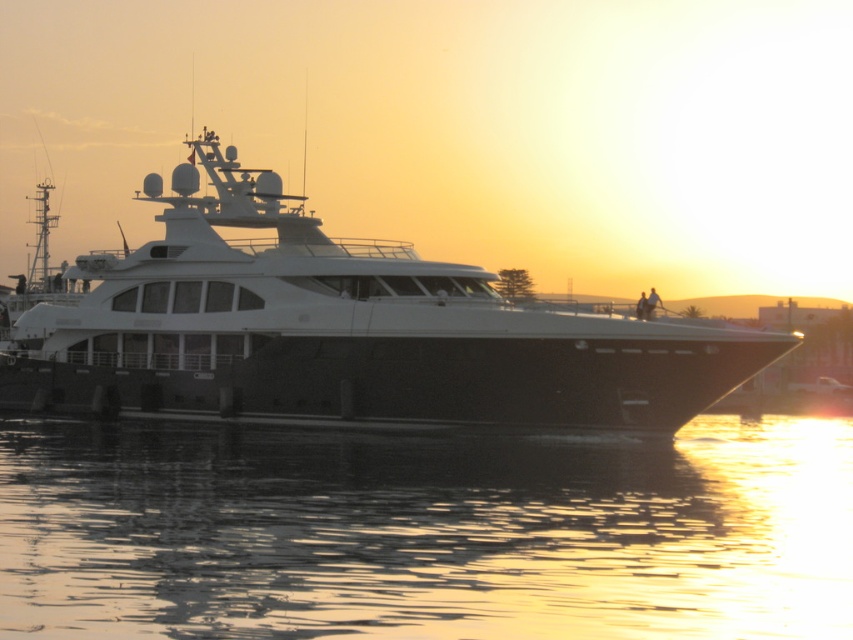
You are standing on the dock and looking at the scene. Which object is closer to you between the glistening water at lower center and the white glossy yacht at center?

The glistening water at lower center is closer to the viewer than the white glossy yacht at center.

You are a photographer planning to capture the sunset reflection on the water near the yacht. Based on the scene, which object takes up more space in the image between the glistening water at lower center and the white glossy yacht at center?

The white glossy yacht at center occupies more space in the image than the glistening water at lower center, as the yacht is described to take up more area.

You are standing on the deck of the yacht and want to take a photo. You notice two points marked on the deck at coordinates point (233, 541) and point (753, 332). Which point should you stand closer to if you want to ensure your photo includes both points without needing to zoom in or out?

You should stand closer to point (233, 541) because it is closer to the camera than point (753, 332), allowing you to capture both points within the frame without adjusting the zoom.